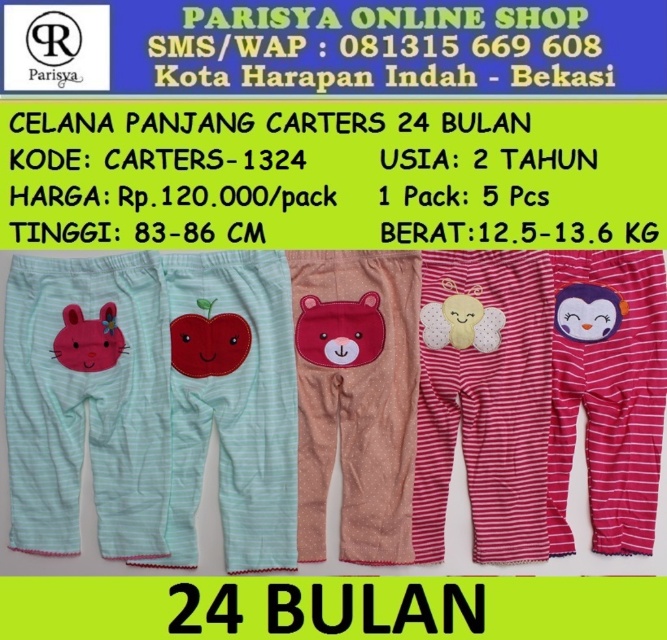
You are a customer looking at the Parisya Online Shop advertisement for childrens clothing. You see two points labeled point 1 at coordinates [105,387] and point 2 at coordinates [239,352]. Which point is closer to you as you view the advertisement?

Point 1 at coordinates [105,387] is closer to the viewer than point 2 at coordinates [239,352].

Based on the photo, you are standing 5 feet away from the point at coordinate point (255, 508). Can you reach it?

The point at coordinate point (255, 508) is 4.25 feet from camera, so yes, you can reach it since you are standing 5 feet away.